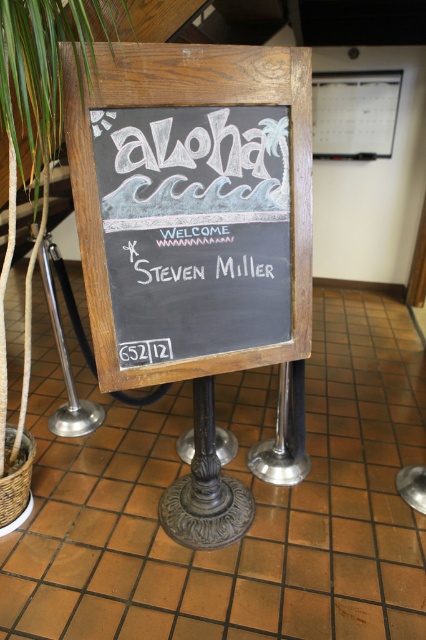
You are standing in front of the chalkboard at center and want to touch the white chalk writing at center. Can you reach it without moving your position?

The chalkboard at center is closer to the viewer than the white chalk writing at center, so you can reach the white chalk writing at center by extending your hand forward since it is on the same board.

You are standing in front of the chalkboard sign. Where is the chalkboard sign located in relation to the point at coordinates (192, 208)?

The chalkboard at center is located exactly at the point (192, 208).